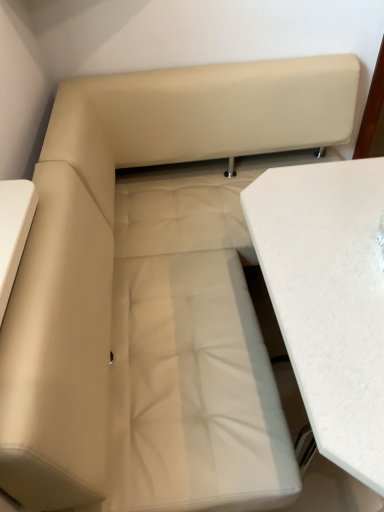
Where is `empty space that is ontop of white glossy table at right`? empty space that is ontop of white glossy table at right is located at coordinates (336, 253).